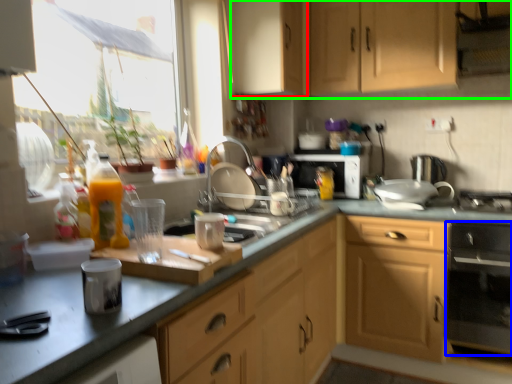
Question: Considering the real-world distances, which object is farthest from cabinetry (highlighted by a red box)? kitchen appliance (highlighted by a blue box) or cabinetry (highlighted by a green box)?

Choices:
 (A) kitchen appliance
 (B) cabinetry

Answer: (A)